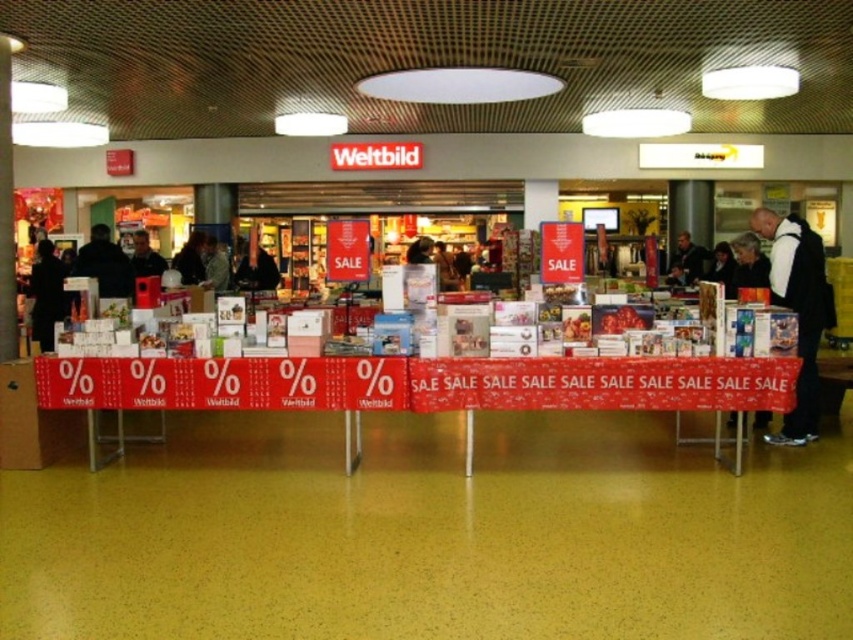
You are a customer looking to purchase a gift for a friend. You notice the dark hair at center and the green fabric jacket at center on display. Which item takes up more horizontal space on the table?

The dark hair at center takes up more horizontal space on the table because its width is larger than that of the green fabric jacket at center.

You are a customer entering the store and notice the red fabric banner at center and the black fabric jacket at right. Which object appears shorter in height?

The red fabric banner at center has a lesser height compared to the black fabric jacket at right, so the red fabric banner at center appears shorter in height.

You are a customer in the store and you see the dark hair at center and the green fabric jacket at center. Which one is positioned lower in the image?

The dark hair at center is positioned below the green fabric jacket at center, so it is lower in the image.